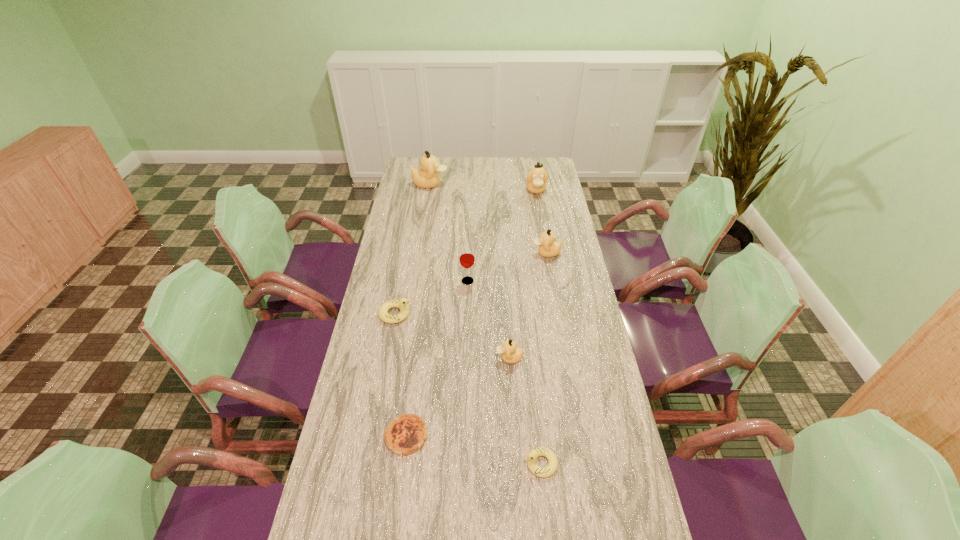
Where is `the third closest tan duckling relative to the tallest duckling`? The height and width of the screenshot is (540, 960). the third closest tan duckling relative to the tallest duckling is located at coordinates (511, 354).

The width and height of the screenshot is (960, 540). I want to click on free spot that satisfies the following two spatial constraints: 1. on the face of the fifth shortest duckling; 2. on the face of the right yellow duckling, so click(583, 463).

You are a GUI agent. You are given a task and a screenshot of the screen. Output one action in this format:
    pyautogui.click(x=<x>, y=<y>)
    Task: Click on the free space that satisfies the following two spatial constraints: 1. on the face of the second biggest tan duckling; 2. on the face of the nearest duckling
    The height and width of the screenshot is (540, 960).
    Given the screenshot: What is the action you would take?
    pyautogui.click(x=583, y=463)

At what (x,y) coordinates should I click in order to perform the action: click on vacant region that satisfies the following two spatial constraints: 1. on the face of the fifth shortest duckling; 2. on the face of the shortest duckling. Please return your answer as a coordinate pair (x, y). Looking at the image, I should click on (583, 463).

Where is `vacant space that satisfies the following two spatial constraints: 1. on the face of the second biggest tan duckling; 2. on the face of the smallest tan duckling`? The height and width of the screenshot is (540, 960). vacant space that satisfies the following two spatial constraints: 1. on the face of the second biggest tan duckling; 2. on the face of the smallest tan duckling is located at coordinates (564, 358).